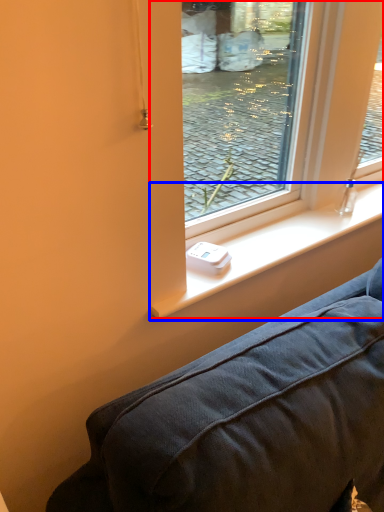
Question: Which object is closer to the camera taking this photo, window screen (highlighted by a red box) or window sill (highlighted by a blue box)?

Choices:
 (A) window screen
 (B) window sill

Answer: (A)